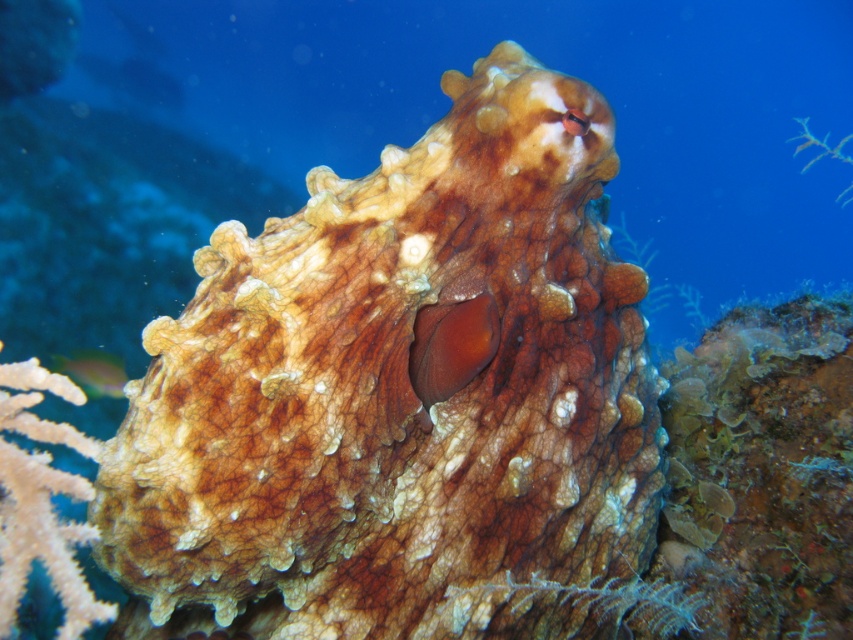
Which is more to the right, brown textured octopus at center or shiny green fish at lower left?

brown textured octopus at center is more to the right.

Is the position of brown textured octopus at center more distant than that of shiny green fish at lower left?

That is False.

In the scene shown: Who is more distant from viewer, (610, 163) or (107, 362)?

The point (107, 362) is more distant.

Identify the location of brown textured octopus at center. The height and width of the screenshot is (640, 853). (404, 394).